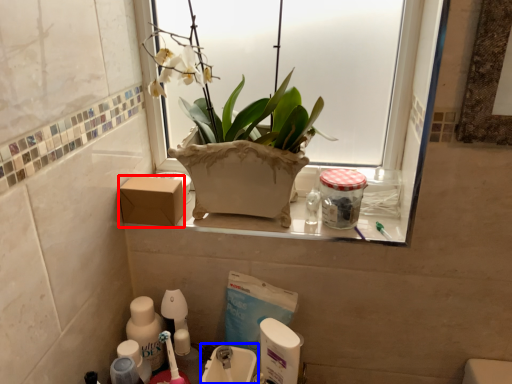
Question: Among these objects, which one is nearest to the camera, cardboard box (highlighted by a red box) or sink (highlighted by a blue box)?

Choices:
 (A) cardboard box
 (B) sink

Answer: (B)